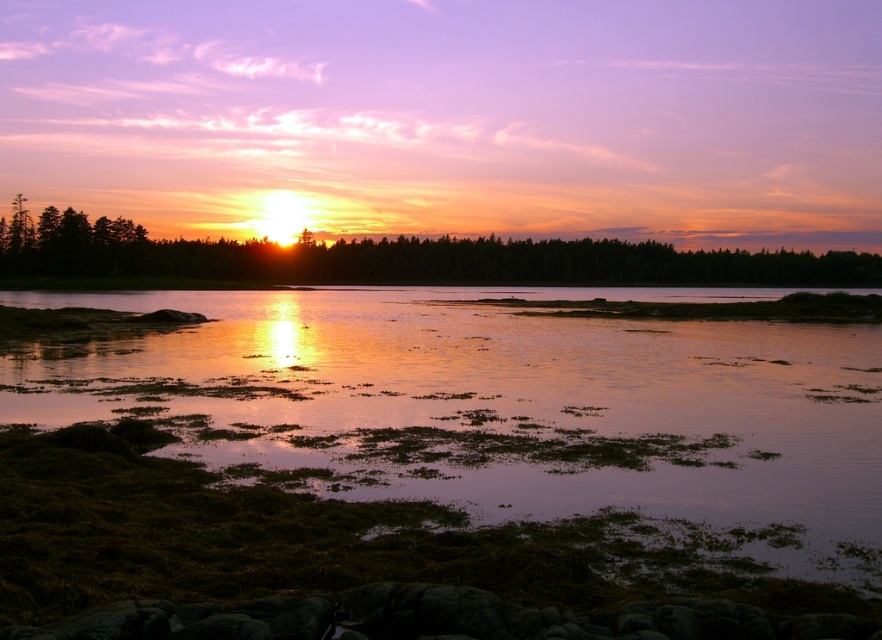
Question: Is green algae at lower center positioned before green leafy trees at center?

Choices:
 (A) no
 (B) yes

Answer: (B)

Question: Which point is closer to the camera?

Choices:
 (A) green algae at lower center
 (B) green leafy trees at center

Answer: (A)

Question: Which point is farther to the camera?

Choices:
 (A) green leafy trees at center
 (B) green algae at lower center

Answer: (A)

Question: Can you confirm if green algae at lower center is smaller than green leafy trees at center?

Choices:
 (A) no
 (B) yes

Answer: (B)

Question: Can you confirm if green algae at lower center is positioned to the left of green leafy trees at center?

Choices:
 (A) no
 (B) yes

Answer: (A)

Question: Among these points, which one is nearest to the camera?

Choices:
 (A) (236, 436)
 (B) (13, 236)

Answer: (A)